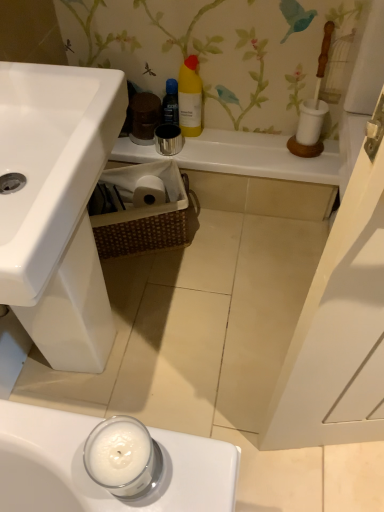
Image resolution: width=384 pixels, height=512 pixels. What are the coordinates of `space that is in front of yellow plastic bottle at upper center` in the screenshot? It's located at (210, 150).